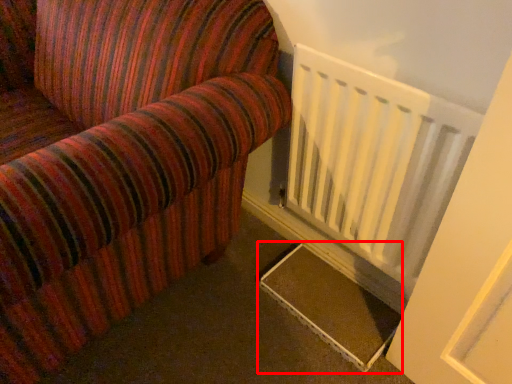
Question: From the image's perspective, considering the relative positions of stairs (annotated by the red box) and radiator in the image provided, where is stairs (annotated by the red box) located with respect to the staircase?

Choices:
 (A) below
 (B) above

Answer: (A)